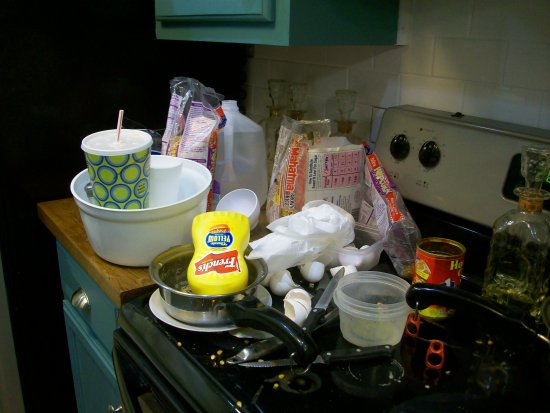
The height and width of the screenshot is (413, 550). I want to click on oven burners, so click(x=248, y=341), click(x=318, y=369).